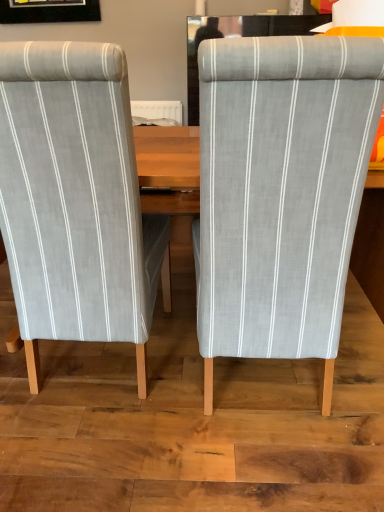
Question: Is gray fabric chair at center, which appears as the 1th chair when viewed from the right, to the right of light gray striped fabric chair at left, arranged as the first chair when viewed from the left, from the viewer's perspective?

Choices:
 (A) yes
 (B) no

Answer: (A)

Question: Can you confirm if gray fabric chair at center, which appears as the 1th chair when viewed from the right, is wider than light gray striped fabric chair at left, arranged as the first chair when viewed from the left?

Choices:
 (A) yes
 (B) no

Answer: (A)

Question: Are gray fabric chair at center, positioned as the second chair in left-to-right order, and light gray striped fabric chair at left, arranged as the first chair when viewed from the left, located far from each other?

Choices:
 (A) yes
 (B) no

Answer: (B)

Question: Is the surface of gray fabric chair at center, which appears as the 1th chair when viewed from the right, in direct contact with light gray striped fabric chair at left, arranged as the first chair when viewed from the left?

Choices:
 (A) no
 (B) yes

Answer: (A)

Question: From the image's perspective, is gray fabric chair at center, which appears as the 1th chair when viewed from the right, on light gray striped fabric chair at left, which is the 2th chair in right-to-left order?

Choices:
 (A) no
 (B) yes

Answer: (A)

Question: Considering the relative sizes of gray fabric chair at center, positioned as the second chair in left-to-right order, and light gray striped fabric chair at left, which is the 2th chair in right-to-left order, in the image provided, is gray fabric chair at center, positioned as the second chair in left-to-right order, bigger than light gray striped fabric chair at left, which is the 2th chair in right-to-left order,?

Choices:
 (A) no
 (B) yes

Answer: (A)

Question: Would you say gray fabric chair at center, positioned as the second chair in left-to-right order, is part of light gray striped fabric chair at left, arranged as the first chair when viewed from the left,'s contents?

Choices:
 (A) yes
 (B) no

Answer: (B)

Question: Does light gray striped fabric chair at left, arranged as the first chair when viewed from the left, have a smaller size compared to gray fabric chair at center, positioned as the second chair in left-to-right order?

Choices:
 (A) yes
 (B) no

Answer: (B)

Question: Considering the relative sizes of light gray striped fabric chair at left, arranged as the first chair when viewed from the left, and gray fabric chair at center, positioned as the second chair in left-to-right order, in the image provided, is light gray striped fabric chair at left, arranged as the first chair when viewed from the left, thinner than gray fabric chair at center, positioned as the second chair in left-to-right order,?

Choices:
 (A) yes
 (B) no

Answer: (A)

Question: Can you confirm if light gray striped fabric chair at left, arranged as the first chair when viewed from the left, is positioned to the right of gray fabric chair at center, which appears as the 1th chair when viewed from the right?

Choices:
 (A) yes
 (B) no

Answer: (B)

Question: Can you confirm if light gray striped fabric chair at left, which is the 2th chair in right-to-left order, is wider than gray fabric chair at center, which appears as the 1th chair when viewed from the right?

Choices:
 (A) yes
 (B) no

Answer: (B)

Question: Is light gray striped fabric chair at left, arranged as the first chair when viewed from the left, behind gray fabric chair at center, positioned as the second chair in left-to-right order?

Choices:
 (A) yes
 (B) no

Answer: (A)

Question: Considering the relative positions of gray fabric chair at center, positioned as the second chair in left-to-right order, and light gray striped fabric chair at left, arranged as the first chair when viewed from the left, in the image provided, is gray fabric chair at center, positioned as the second chair in left-to-right order, to the left or to the right of light gray striped fabric chair at left, arranged as the first chair when viewed from the left,?

Choices:
 (A) left
 (B) right

Answer: (B)